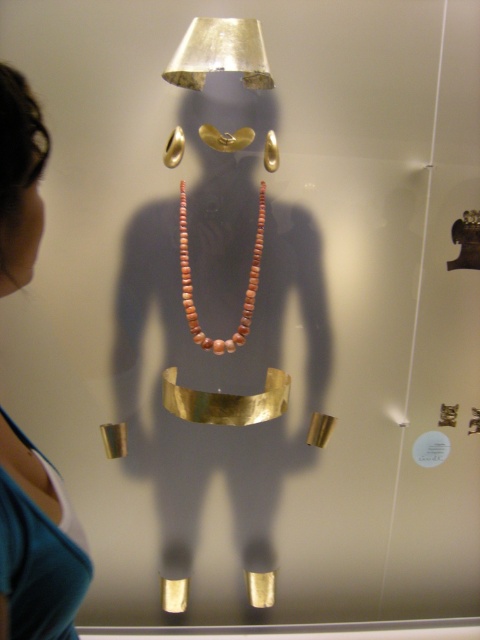
Is teal fabric top at left to the left of metallic gold bracelet at upper center from the viewer's perspective?

Indeed, teal fabric top at left is positioned on the left side of metallic gold bracelet at upper center.

From the picture: Who is positioned more to the right, teal fabric top at left or metallic gold bracelet at upper center?

metallic gold bracelet at upper center

Does point (16, 628) come behind point (173, 68)?

No, (16, 628) is closer to viewer.

Where is `teal fabric top at left`? The width and height of the screenshot is (480, 640). teal fabric top at left is located at coordinates (36, 545).

Based on the photo, can you confirm if metallic gold bracelet at upper center is thinner than matte coral necklace at center?

In fact, metallic gold bracelet at upper center might be wider than matte coral necklace at center.

Is point (260, 65) closer to viewer compared to point (186, 285)?

That is True.

This screenshot has height=640, width=480. I want to click on metallic gold bracelet at upper center, so click(x=219, y=52).

Does teal fabric top at left have a greater width compared to matte coral necklace at center?

No, teal fabric top at left is not wider than matte coral necklace at center.

Is teal fabric top at left thinner than matte coral necklace at center?

Correct, teal fabric top at left's width is less than matte coral necklace at center's.

Find the location of a particular element. Image resolution: width=480 pixels, height=640 pixels. teal fabric top at left is located at coordinates (36, 545).